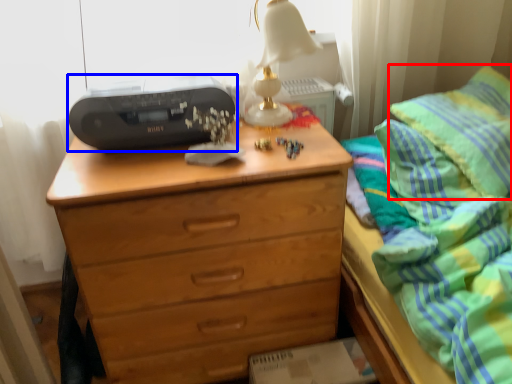
Question: Which of the following is the closest to the observer, pillow (highlighted by a red box) or printer (highlighted by a blue box)?

Choices:
 (A) pillow
 (B) printer

Answer: (A)